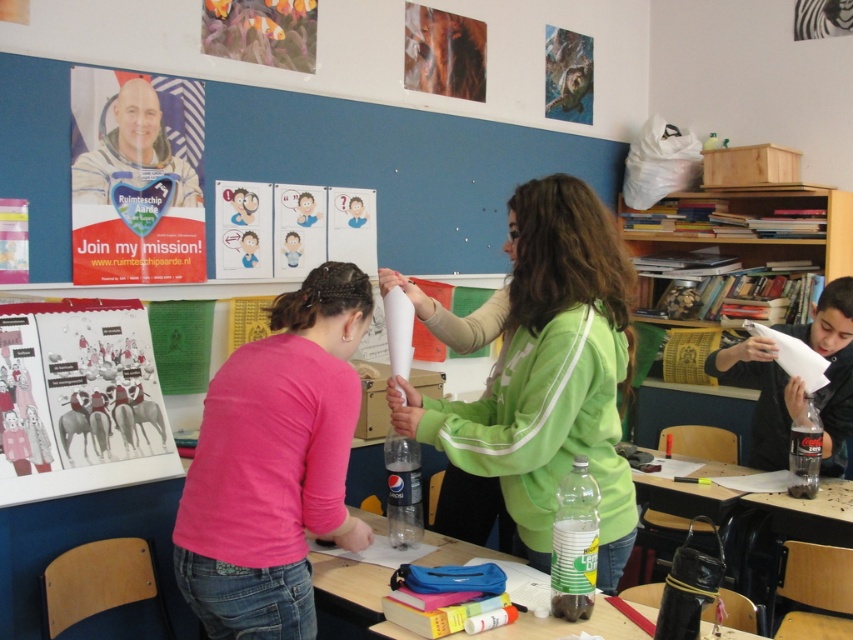
Does pink fabric shirt at center have a greater height compared to matte green sweatshirt at center?

No.

Who is more forward, (347, 324) or (605, 256)?

Point (605, 256) is more forward.

Who is more distant from viewer, (x=233, y=355) or (x=585, y=401)?

The point (x=233, y=355) is behind.

Image resolution: width=853 pixels, height=640 pixels. I want to click on pink fabric shirt at center, so click(274, 465).

Who is positioned more to the right, black plastic bottle at right or space suit astronaut at upper left?

Positioned to the right is black plastic bottle at right.

Which is above, black plastic bottle at right or space suit astronaut at upper left?

space suit astronaut at upper left

Is point (775, 369) positioned before point (117, 100)?

No, (775, 369) is behind (117, 100).

Locate an element on the screen. black plastic bottle at right is located at coordinates (831, 368).

Which is behind, point (93, 467) or point (386, 573)?

Point (93, 467)

Does point (96, 346) lie in front of point (375, 564)?

That is False.

Does point (73, 435) lie in front of point (445, 541)?

No, (73, 435) is further to viewer.

This screenshot has height=640, width=853. Find the location of `matte paper poster at upper left`. matte paper poster at upper left is located at coordinates (78, 400).